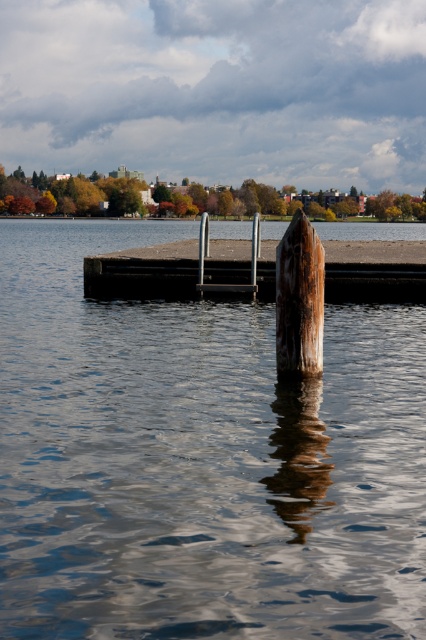
Question: Considering the real-world distances, which object is closest to the rusty wood post at center?

Choices:
 (A) wooden dock at center
 (B) smooth dark water at center

Answer: (B)

Question: Does smooth dark water at center appear over wooden dock at center?

Choices:
 (A) yes
 (B) no

Answer: (B)

Question: Does smooth dark water at center appear on the left side of rusty wood post at center?

Choices:
 (A) no
 (B) yes

Answer: (B)

Question: Is smooth dark water at center positioned in front of wooden dock at center?

Choices:
 (A) no
 (B) yes

Answer: (B)

Question: Which object is farther from the camera taking this photo?

Choices:
 (A) rusty wood post at center
 (B) smooth dark water at center
 (C) wooden dock at center

Answer: (C)

Question: Which point is farther to the camera?

Choices:
 (A) rusty wood post at center
 (B) smooth dark water at center

Answer: (A)